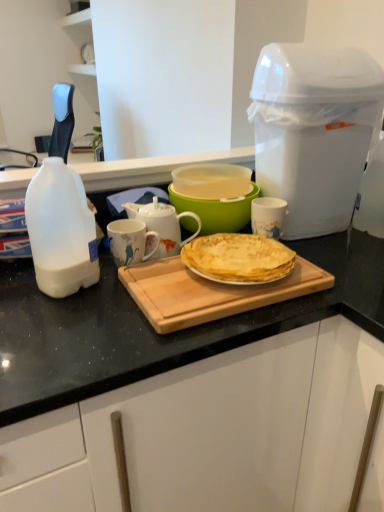
Question: Is white plastic trash can at upper right far away from white ceramic mug at center?

Choices:
 (A) yes
 (B) no

Answer: (B)

Question: From the image's perspective, is white plastic trash can at upper right below white ceramic mug at center?

Choices:
 (A) yes
 (B) no

Answer: (B)

Question: Is the depth of white plastic trash can at upper right less than that of white ceramic mug at center?

Choices:
 (A) no
 (B) yes

Answer: (B)

Question: Is white plastic trash can at upper right at the right side of white ceramic mug at center?

Choices:
 (A) yes
 (B) no

Answer: (A)

Question: Considering the relative sizes of white plastic trash can at upper right and white ceramic mug at center in the image provided, is white plastic trash can at upper right taller than white ceramic mug at center?

Choices:
 (A) yes
 (B) no

Answer: (A)

Question: Is yellow crepe at center spatially inside white ceramic mug at center, or outside of it?

Choices:
 (A) outside
 (B) inside

Answer: (A)

Question: Considering the relative positions of yellow crepe at center and white ceramic mug at center in the image provided, is yellow crepe at center to the left or to the right of white ceramic mug at center?

Choices:
 (A) left
 (B) right

Answer: (B)

Question: In terms of width, does yellow crepe at center look wider or thinner when compared to white ceramic mug at center?

Choices:
 (A) wide
 (B) thin

Answer: (A)

Question: From the image's perspective, is yellow crepe at center positioned above or below white ceramic mug at center?

Choices:
 (A) below
 (B) above

Answer: (A)

Question: Considering their positions, is wooden cutting board at center located in front of or behind white glossy mug at center, which is the first mug from right to left?

Choices:
 (A) behind
 (B) front

Answer: (B)

Question: Visually, is wooden cutting board at center positioned to the left or to the right of white glossy mug at center, which is the first mug from right to left?

Choices:
 (A) right
 (B) left

Answer: (B)

Question: Is wooden cutting board at center inside the boundaries of white glossy mug at center, which is the first mug from right to left, or outside?

Choices:
 (A) inside
 (B) outside

Answer: (B)

Question: In terms of size, does wooden cutting board at center appear bigger or smaller than white glossy mug at center, which is the first mug from right to left?

Choices:
 (A) big
 (B) small

Answer: (A)

Question: From the image's perspective, is white ceramic mug at center, positioned as the 2th mug in right-to-left order, located above or below wooden cutting board at center?

Choices:
 (A) below
 (B) above

Answer: (B)

Question: Considering the positions of white ceramic mug at center, positioned as the 2th mug in right-to-left order, and wooden cutting board at center in the image, is white ceramic mug at center, positioned as the 2th mug in right-to-left order, wider or thinner than wooden cutting board at center?

Choices:
 (A) wide
 (B) thin

Answer: (B)